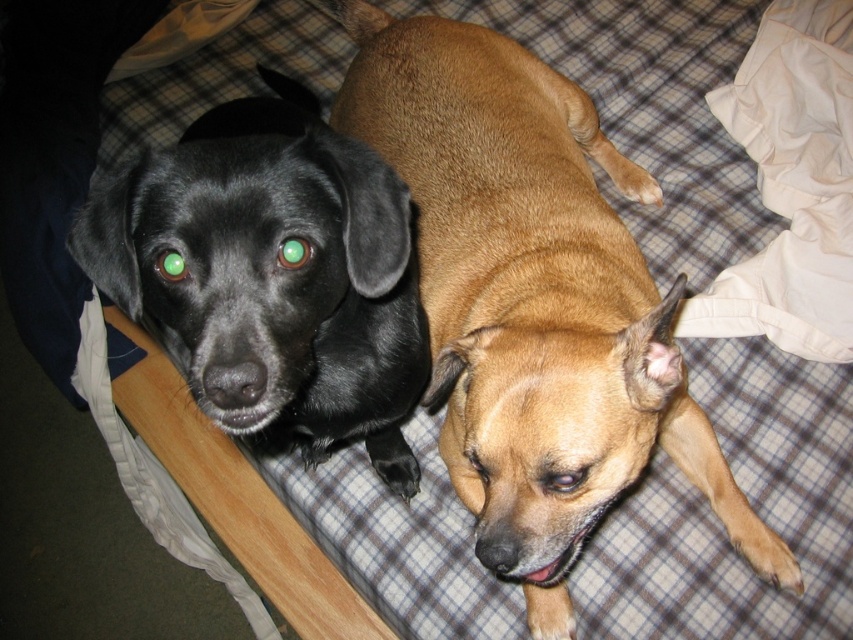
Question: Can you confirm if brown matte dog at center is wider than shiny black dog at left?

Choices:
 (A) yes
 (B) no

Answer: (A)

Question: Which of the following is the farthest from the observer?

Choices:
 (A) (213, 124)
 (B) (482, 100)

Answer: (B)

Question: Does brown matte dog at center have a lesser width compared to shiny black dog at left?

Choices:
 (A) yes
 (B) no

Answer: (B)

Question: Which of the following is the closest to the observer?

Choices:
 (A) pyautogui.click(x=202, y=317)
 (B) pyautogui.click(x=614, y=173)

Answer: (A)

Question: Does brown matte dog at center have a larger size compared to shiny black dog at left?

Choices:
 (A) no
 (B) yes

Answer: (B)